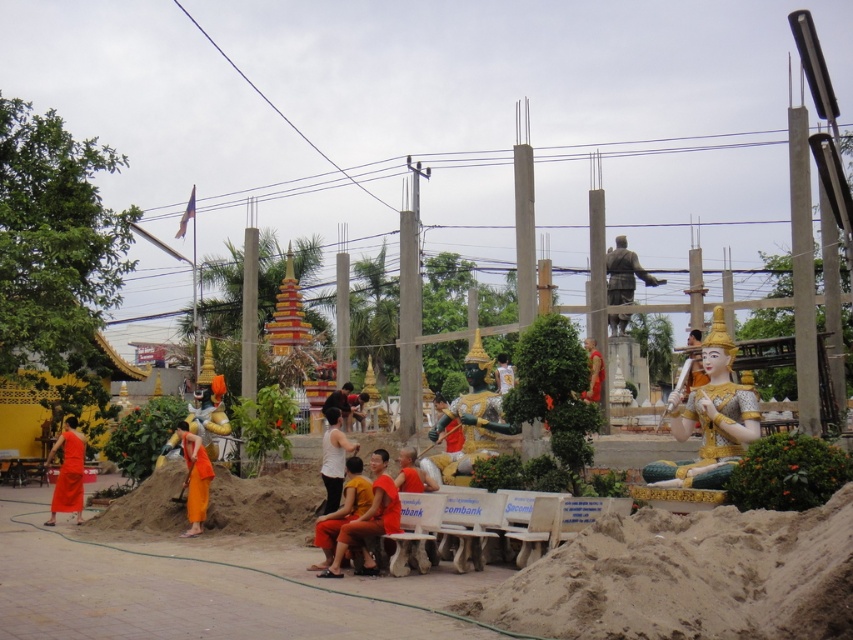
Is point (67, 461) closer to viewer compared to point (503, 384)?

That is True.

Who is shorter, matte orange robe at left or golden statue at center?

With less height is golden statue at center.

Is point (83, 451) behind point (498, 376)?

No.

This screenshot has width=853, height=640. Identify the location of matte orange robe at left. (68, 472).

From the picture: Can you confirm if matte orange robe at left is wider than orange fabric statue at center?

Yes, matte orange robe at left is wider than orange fabric statue at center.

Describe the element at coordinates (68, 472) in the screenshot. The image size is (853, 640). I see `matte orange robe at left` at that location.

Is point (67, 442) farther from viewer compared to point (601, 372)?

No.

Find the location of a particular element. matte orange robe at left is located at coordinates (68, 472).

Is point (323, 576) less distant than point (651, 275)?

Yes, point (323, 576) is closer to viewer.

Where is `orange clothed person at center`? The width and height of the screenshot is (853, 640). orange clothed person at center is located at coordinates (367, 522).

Between point (370, 458) and point (642, 269), which one is positioned in front?

Positioned in front is point (370, 458).

Locate an element on the screen. The image size is (853, 640). orange clothed person at center is located at coordinates click(367, 522).